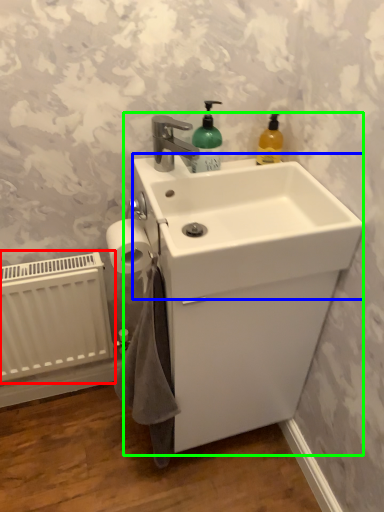
Question: Based on their relative distances, which object is farther from radiator (highlighted by a red box)? Choose from counter top (highlighted by a blue box) and sink (highlighted by a green box).

Choices:
 (A) counter top
 (B) sink

Answer: (A)